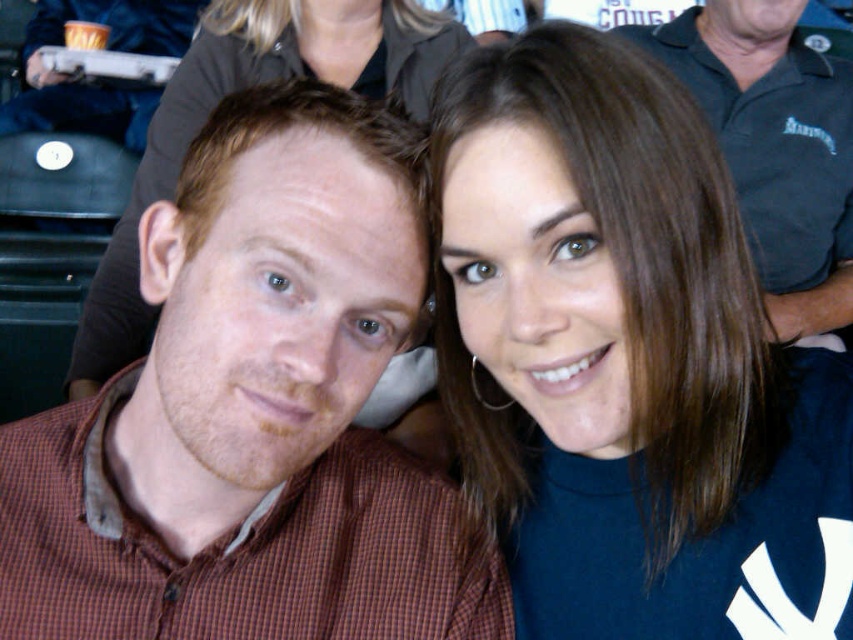
Is brown hair at upper right shorter than matte blue turtleneck at upper right?

Indeed, brown hair at upper right has a lesser height compared to matte blue turtleneck at upper right.

Who is more distant from viewer, (567, 436) or (389, 40)?

Result: Positioned behind is point (389, 40).

Who is more forward, (589, 230) or (180, 131)?

Point (589, 230) is in front.

You are a GUI agent. You are given a task and a screenshot of the screen. Output one action in this format:
    pyautogui.click(x=<x>, y=<y>)
    Task: Click on the brown hair at upper right
    This screenshot has width=853, height=640.
    Given the screenshot: What is the action you would take?
    pyautogui.click(x=627, y=362)

Is brown checkered shirt at left to the left of dark blue polo shirt at upper center from the viewer's perspective?

Correct, you'll find brown checkered shirt at left to the left of dark blue polo shirt at upper center.

Does brown checkered shirt at left come in front of dark blue polo shirt at upper center?

Yes, brown checkered shirt at left is in front of dark blue polo shirt at upper center.

Image resolution: width=853 pixels, height=640 pixels. Describe the element at coordinates (254, 412) in the screenshot. I see `brown checkered shirt at left` at that location.

Where is `brown checkered shirt at left`? The height and width of the screenshot is (640, 853). brown checkered shirt at left is located at coordinates (254, 412).

Which is behind, point (225, 364) or point (160, 172)?

Point (160, 172)

From the picture: Measure the distance between brown checkered shirt at left and camera.

brown checkered shirt at left and camera are 20.12 inches apart from each other.

Does point (318, 275) lie behind point (402, 397)?

No.

I want to click on brown checkered shirt at left, so click(254, 412).